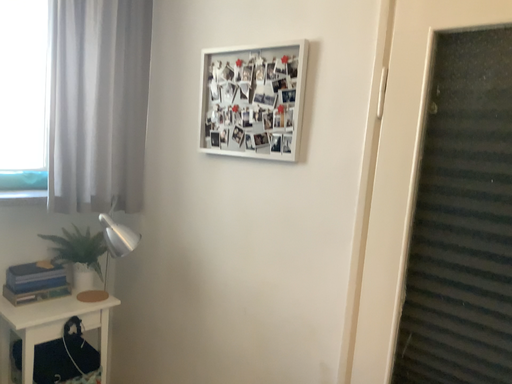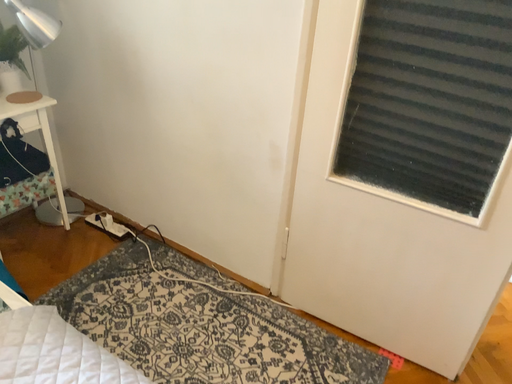
Question: Which way did the camera rotate in the video?

Choices:
 (A) rotated downward
 (B) rotated upward

Answer: (A)